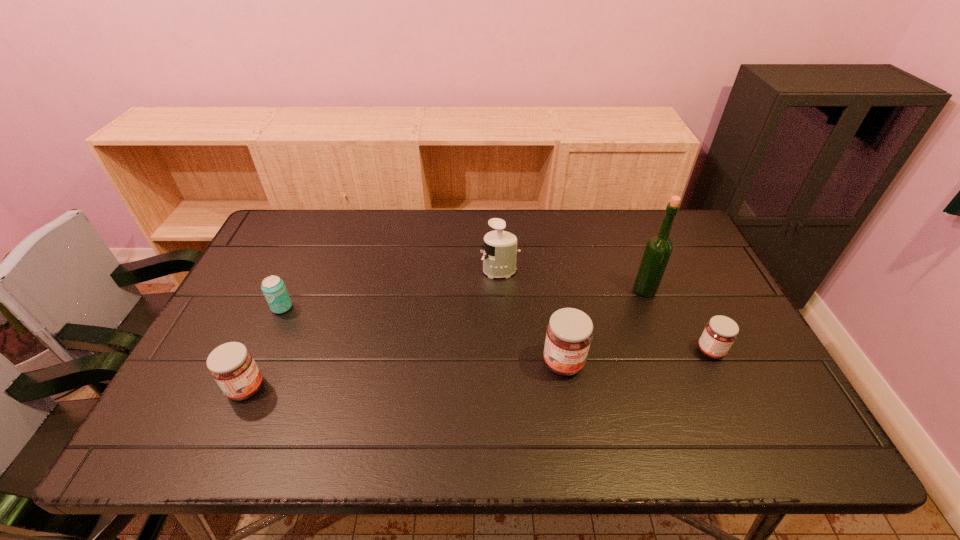
This screenshot has width=960, height=540. I want to click on object that is at the near left corner, so click(232, 366).

In the image, there is a desktop. At what (x,y) coordinates should I click in order to perform the action: click on blank space at the far edge. Please return your answer as a coordinate pair (x, y). Looking at the image, I should click on (408, 217).

What are the coordinates of `free location at the near edge` in the screenshot? It's located at (704, 379).

This screenshot has width=960, height=540. Identify the location of free space at the left edge of the desktop. (263, 338).

The image size is (960, 540). In order to click on free space at the right edge of the desktop in this screenshot , I will do `click(755, 346)`.

Where is `free space at the far left corner of the desktop`? This screenshot has width=960, height=540. free space at the far left corner of the desktop is located at coordinates (276, 247).

Identify the location of free region at the near left corner. (194, 386).

You are a GUI agent. You are given a task and a screenshot of the screen. Output one action in this format:
    pyautogui.click(x=<x>, y=<y>)
    Task: Click on the blank space at the far right corner
    The image size is (960, 540).
    Given the screenshot: What is the action you would take?
    pyautogui.click(x=653, y=229)

I want to click on empty space between the fourth object from right to left and the beer can, so click(x=391, y=289).

In order to click on vacant area that lies between the beer can and the third shortest object in this screenshot , I will do `click(264, 348)`.